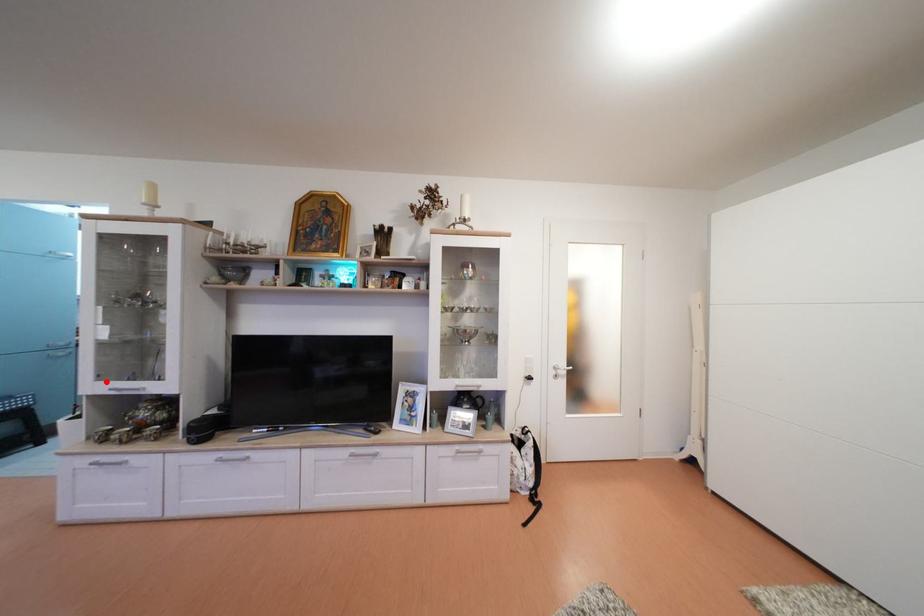
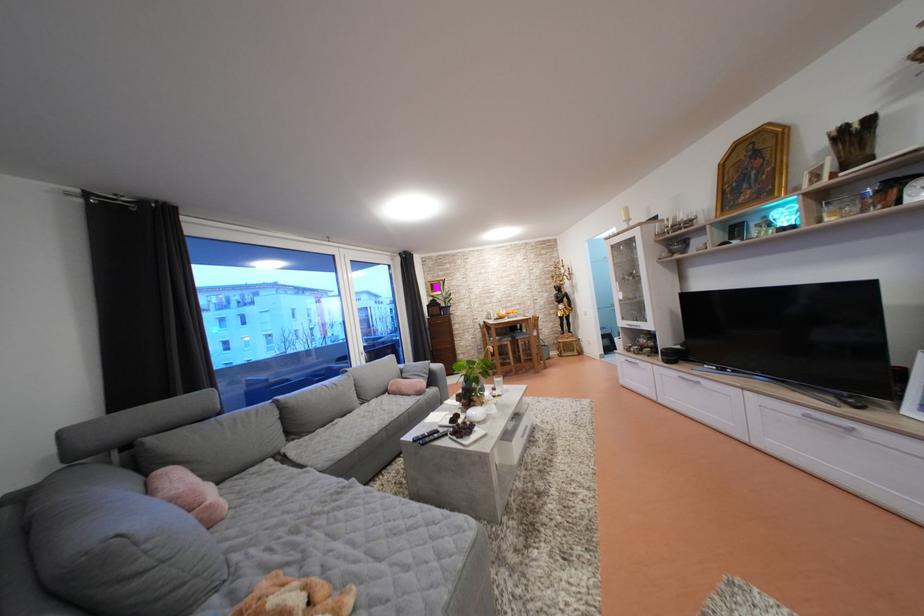
Question: I am providing you with two images of the same scene from different viewpoints. A red point is marked on the first image. Is the red point's position out of view in image 2?

Choices:
 (A) Yes
 (B) No

Answer: (B)